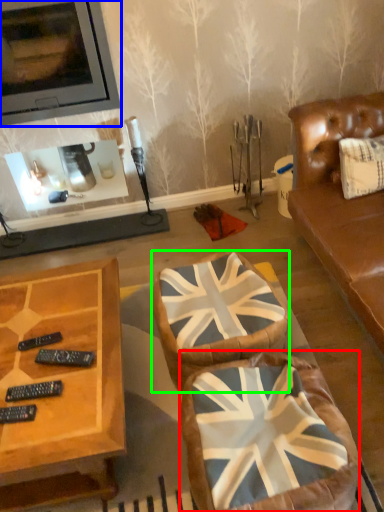
Question: Considering the real-world distances, which object is farthest from swivel chair (highlighted by a red box)? picture frame (highlighted by a blue box) or swivel chair (highlighted by a green box)?

Choices:
 (A) picture frame
 (B) swivel chair

Answer: (A)